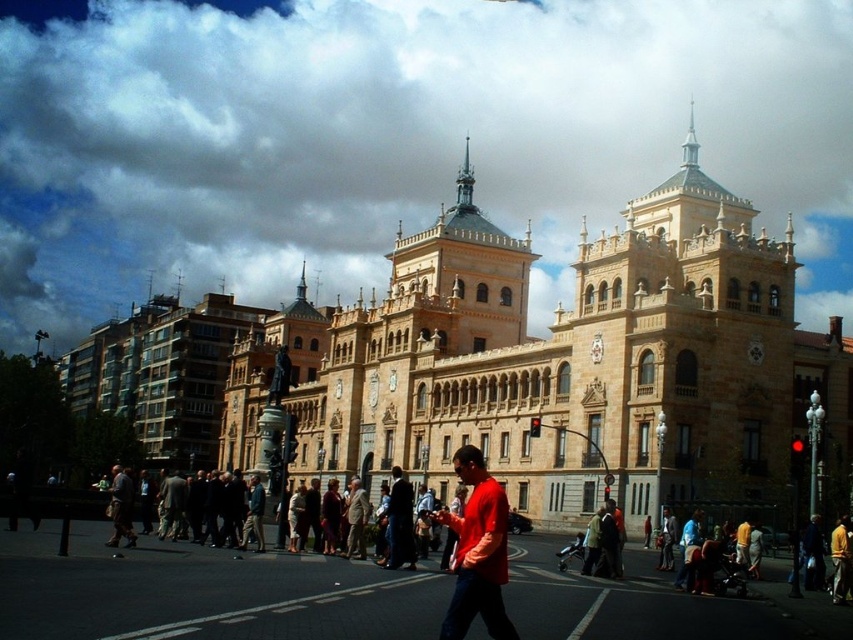
Question: Considering the real-world distances, which object is closest to the golden stone palace at center?

Choices:
 (A) dark blue jeans at center
 (B) light brown leather jacket at center
 (C) matte red shirt at center

Answer: (B)

Question: Which point is farther to the camera?

Choices:
 (A) (392, 544)
 (B) (448, 307)
 (C) (358, 513)
 (D) (480, 524)

Answer: (B)

Question: Does golden stone palace at center have a greater width compared to dark blue jeans at center?

Choices:
 (A) no
 (B) yes

Answer: (B)

Question: Can you confirm if matte red shirt at center is smaller than light brown leather jacket at center?

Choices:
 (A) yes
 (B) no

Answer: (A)

Question: In this image, where is golden stone palace at center located relative to light brown leather jacket at center?

Choices:
 (A) below
 (B) above

Answer: (B)

Question: Which object is closer to the camera taking this photo?

Choices:
 (A) matte red shirt at center
 (B) golden stone palace at center
 (C) dark blue jeans at center

Answer: (A)